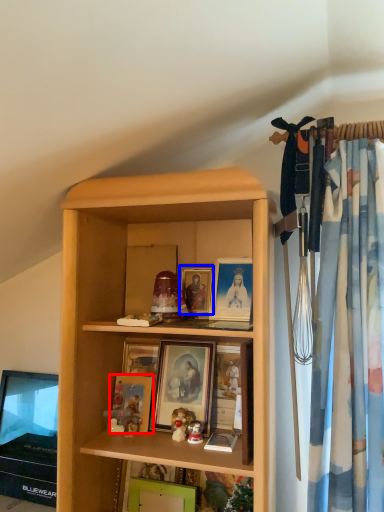
Question: Among these objects, which one is farthest to the camera, picture frame (highlighted by a red box) or picture frame (highlighted by a blue box)?

Choices:
 (A) picture frame
 (B) picture frame

Answer: (B)